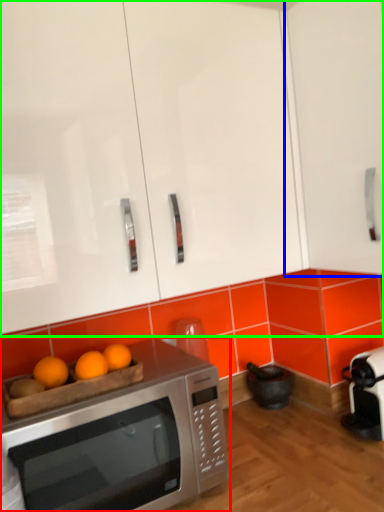
Question: Which object is the closest to the microwave oven (highlighted by a red box)? Choose among these: cabinetry (highlighted by a blue box) or cabinetry (highlighted by a green box).

Choices:
 (A) cabinetry
 (B) cabinetry

Answer: (B)